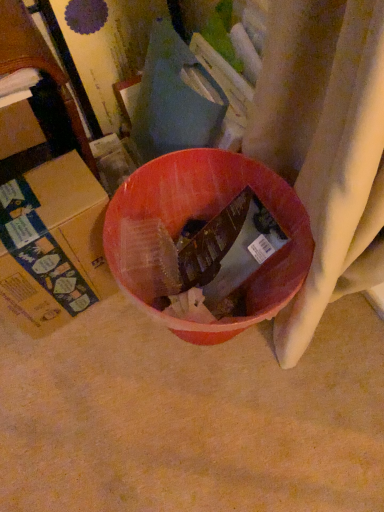
Question: Can you confirm if cardboard box at left, which is counted as the second cardboard box, starting from the bottom, is wider than cardboard box at left, the 1th cardboard box from the bottom?

Choices:
 (A) yes
 (B) no

Answer: (B)

Question: Can you confirm if cardboard box at left, which is counted as the second cardboard box, starting from the bottom, is positioned to the left of cardboard box at left, the 1th cardboard box from the bottom?

Choices:
 (A) no
 (B) yes

Answer: (B)

Question: Is cardboard box at left, which is counted as the second cardboard box, starting from the bottom, further to the viewer compared to cardboard box at left, the 1th cardboard box from the bottom?

Choices:
 (A) yes
 (B) no

Answer: (A)

Question: Considering the relative sizes of cardboard box at left, marked as the 1th cardboard box in a top-to-bottom arrangement, and cardboard box at left, the 1th cardboard box from the bottom, in the image provided, is cardboard box at left, marked as the 1th cardboard box in a top-to-bottom arrangement, bigger than cardboard box at left, the 1th cardboard box from the bottom,?

Choices:
 (A) no
 (B) yes

Answer: (A)

Question: Is there a large distance between cardboard box at left, which is counted as the second cardboard box, starting from the bottom, and cardboard box at left, the 1th cardboard box from the bottom?

Choices:
 (A) yes
 (B) no

Answer: (B)

Question: Is cardboard box at left, the 1th cardboard box from the bottom, completely or partially inside cardboard box at left, marked as the 1th cardboard box in a top-to-bottom arrangement?

Choices:
 (A) no
 (B) yes

Answer: (A)

Question: Is there a large distance between cardboard box at left, positioned as the second cardboard box in top-to-bottom order, and cardboard box at left, which is counted as the second cardboard box, starting from the bottom?

Choices:
 (A) yes
 (B) no

Answer: (B)

Question: Are cardboard box at left, the 1th cardboard box from the bottom, and cardboard box at left, which is counted as the second cardboard box, starting from the bottom, beside each other?

Choices:
 (A) no
 (B) yes

Answer: (A)

Question: Is cardboard box at left, the 1th cardboard box from the bottom, taller than cardboard box at left, marked as the 1th cardboard box in a top-to-bottom arrangement?

Choices:
 (A) yes
 (B) no

Answer: (A)

Question: Does cardboard box at left, the 1th cardboard box from the bottom, lie in front of cardboard box at left, marked as the 1th cardboard box in a top-to-bottom arrangement?

Choices:
 (A) yes
 (B) no

Answer: (A)

Question: Considering the relative sizes of cardboard box at left, positioned as the second cardboard box in top-to-bottom order, and cardboard box at left, which is counted as the second cardboard box, starting from the bottom, in the image provided, is cardboard box at left, positioned as the second cardboard box in top-to-bottom order, smaller than cardboard box at left, which is counted as the second cardboard box, starting from the bottom,?

Choices:
 (A) yes
 (B) no

Answer: (B)

Question: Can you confirm if cardboard box at left, the 1th cardboard box from the bottom, is shorter than cardboard box at left, marked as the 1th cardboard box in a top-to-bottom arrangement?

Choices:
 (A) yes
 (B) no

Answer: (B)

Question: Is point (4, 117) positioned closer to the camera than point (76, 217)?

Choices:
 (A) farther
 (B) closer

Answer: (A)